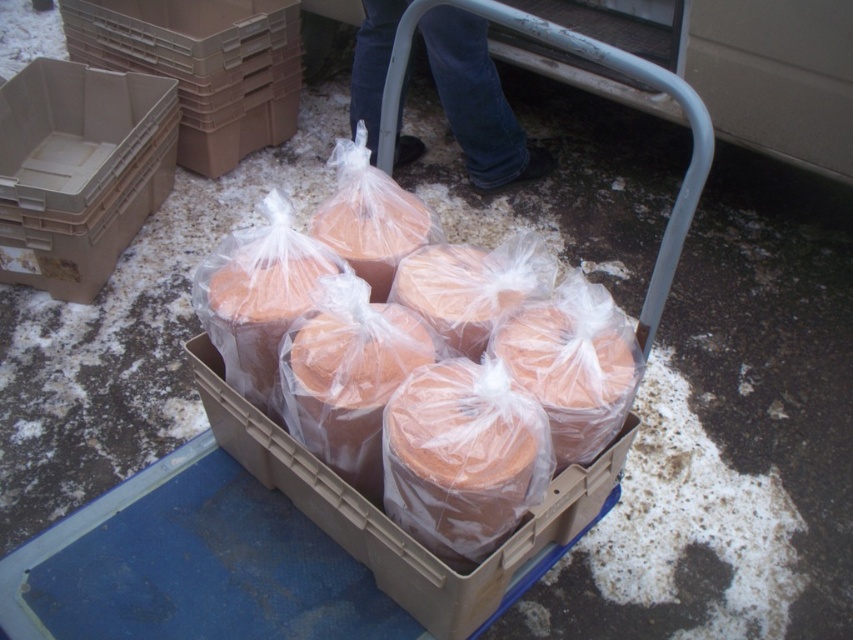
You are a delivery person who needs to place a package on the translucent plastic containers at center. According to the coordinates provided, where exactly should you place the package?

The translucent plastic containers at center are located at coordinates point [402,403], so you should place the package precisely at that coordinate point.